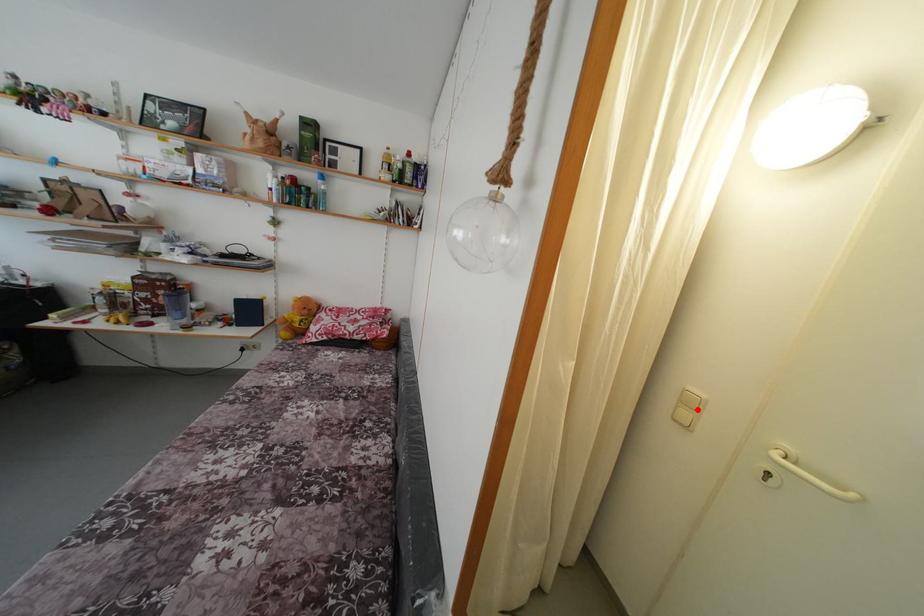
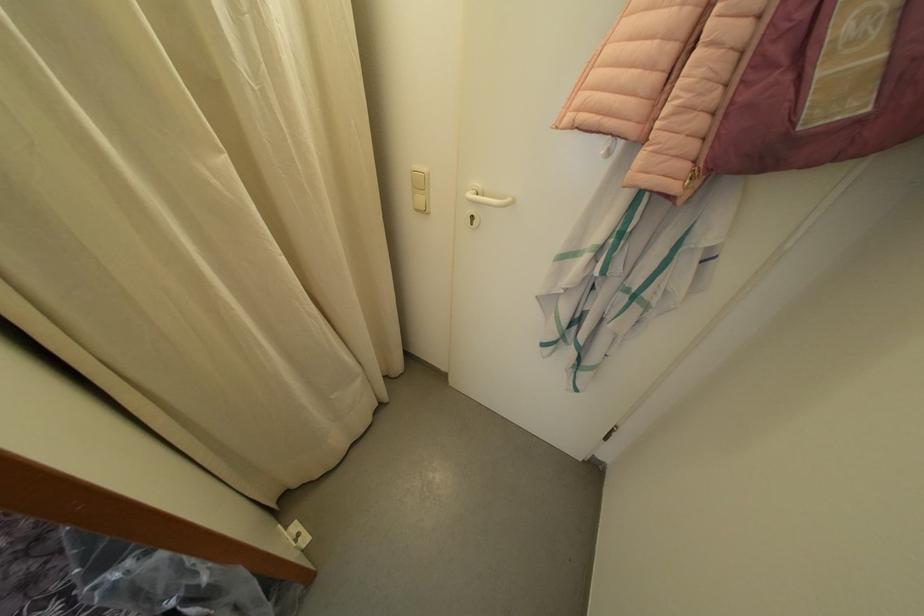
Find the pixel in the second image that matches the highlighted location in the first image.

(427, 191)